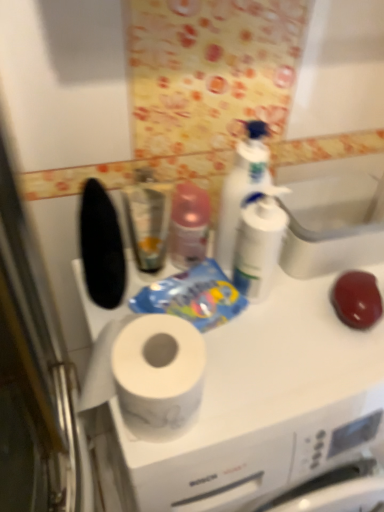
Where is `vacant region to the right of white plastic pump bottle at center`? vacant region to the right of white plastic pump bottle at center is located at coordinates (314, 316).